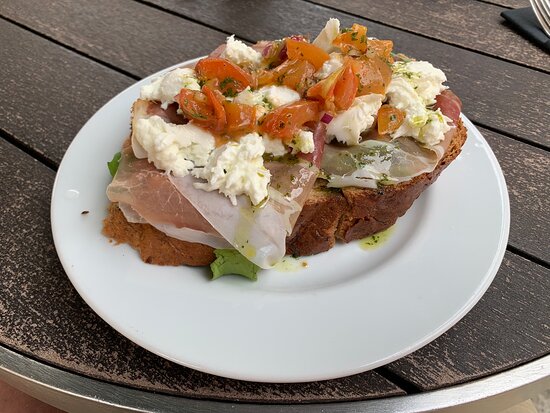
Identify the location of plate. (341, 301).